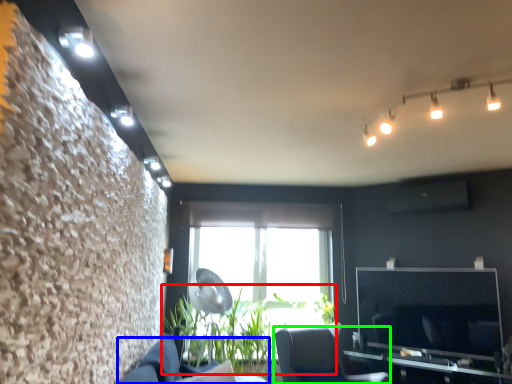
Question: Considering the real-world distances, which object is farthest from plant (highlighted by a red box)? couch (highlighted by a blue box) or furniture (highlighted by a green box)?

Choices:
 (A) couch
 (B) furniture

Answer: (A)